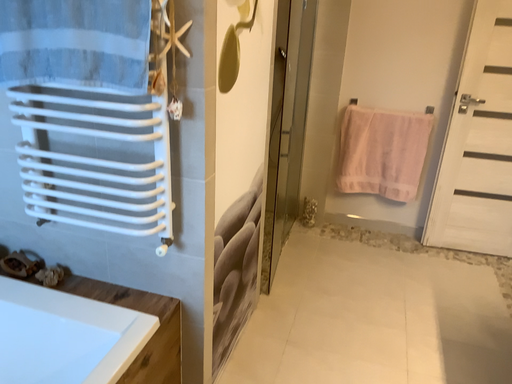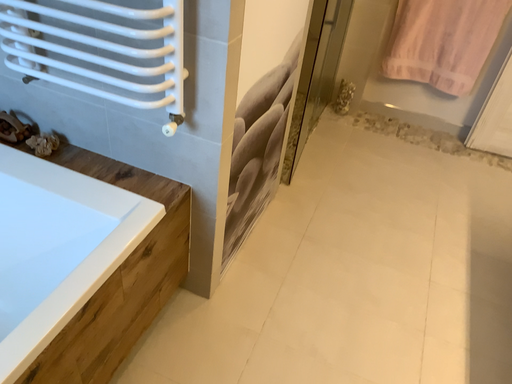
Question: How did the camera likely rotate when shooting the video?

Choices:
 (A) rotated upward
 (B) rotated downward

Answer: (B)